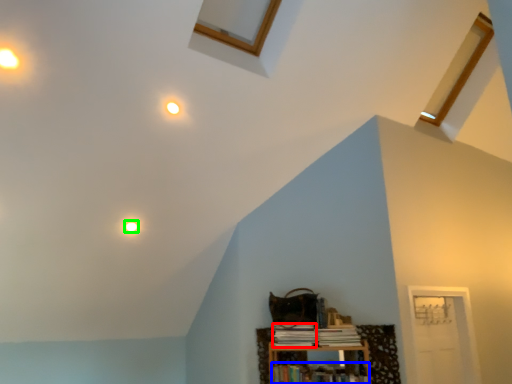
Question: Which object is the farthest from book (highlighted by a red box)? Choose among these: book (highlighted by a blue box) or light (highlighted by a green box).

Choices:
 (A) book
 (B) light

Answer: (B)